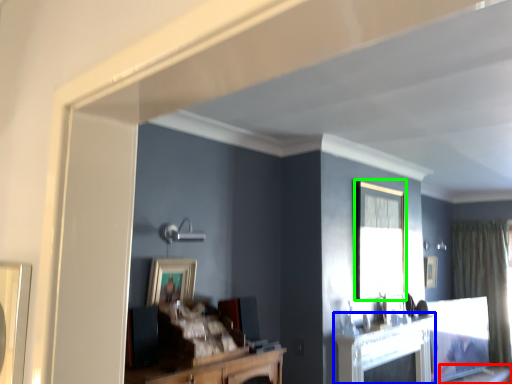
Question: Which object is the farthest from table (highlighted by a red box)? Choose among these: fireplace (highlighted by a blue box) or window (highlighted by a green box).

Choices:
 (A) fireplace
 (B) window

Answer: (B)